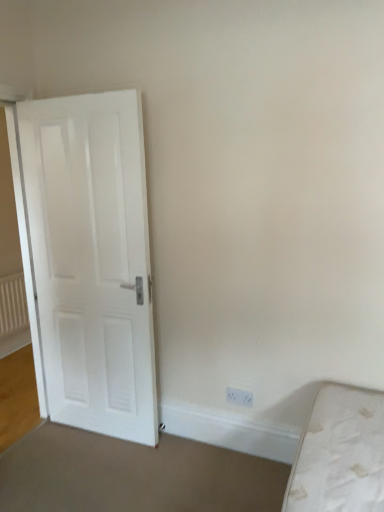
The image size is (384, 512). I want to click on free point in front of white matte door at left, so click(90, 472).